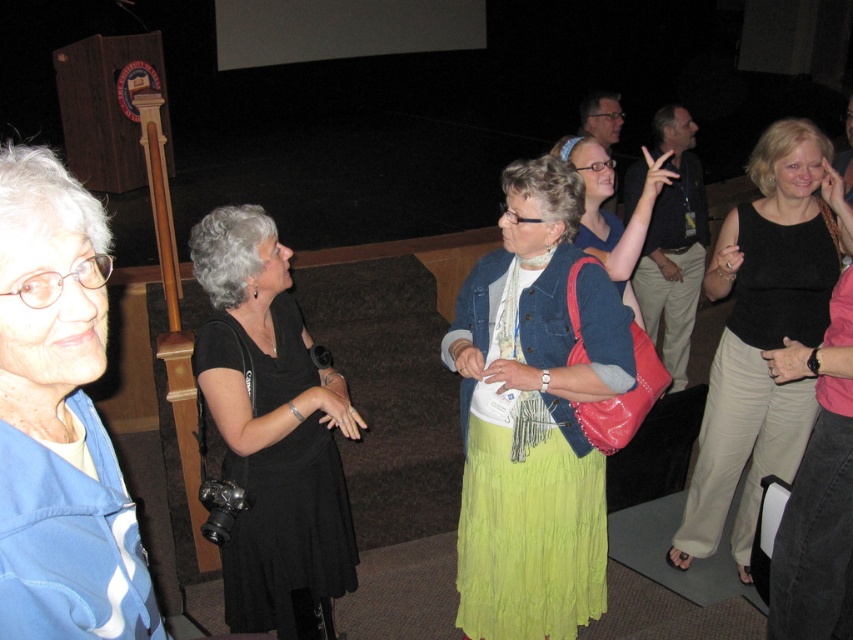
Does denim jacket at center have a greater height compared to black jersey at right?

Indeed, denim jacket at center has a greater height compared to black jersey at right.

This screenshot has width=853, height=640. I want to click on denim jacket at center, so click(x=532, y=417).

You are a GUI agent. You are given a task and a screenshot of the screen. Output one action in this format:
    pyautogui.click(x=<x>, y=<y>)
    Task: Click on the denim jacket at center
    
    Given the screenshot: What is the action you would take?
    pyautogui.click(x=532, y=417)

Does denim jacket at center appear under black satin dress at center?

No, denim jacket at center is not below black satin dress at center.

Which of these two, denim jacket at center or black satin dress at center, stands shorter?

black satin dress at center

Describe the element at coordinates (532, 417) in the screenshot. The height and width of the screenshot is (640, 853). I see `denim jacket at center` at that location.

Identify the location of denim jacket at center. This screenshot has width=853, height=640. (532, 417).

Who is more distant from viewer, [746,234] or [231,550]?

The point [746,234] is more distant.

Consider the image. Can you confirm if black smooth tank top at right is smaller than black satin dress at center?

No, black smooth tank top at right is not smaller than black satin dress at center.

I want to click on black smooth tank top at right, so click(764, 332).